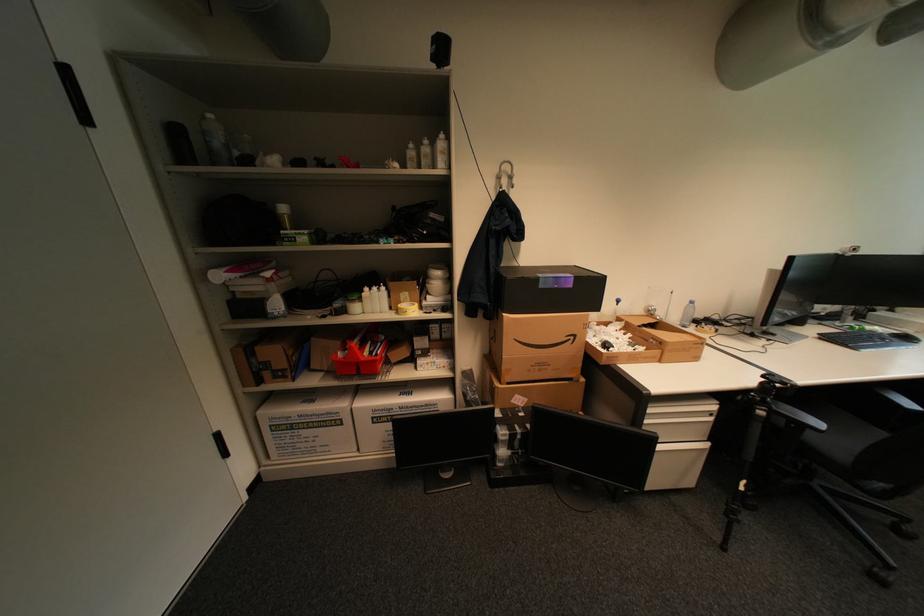
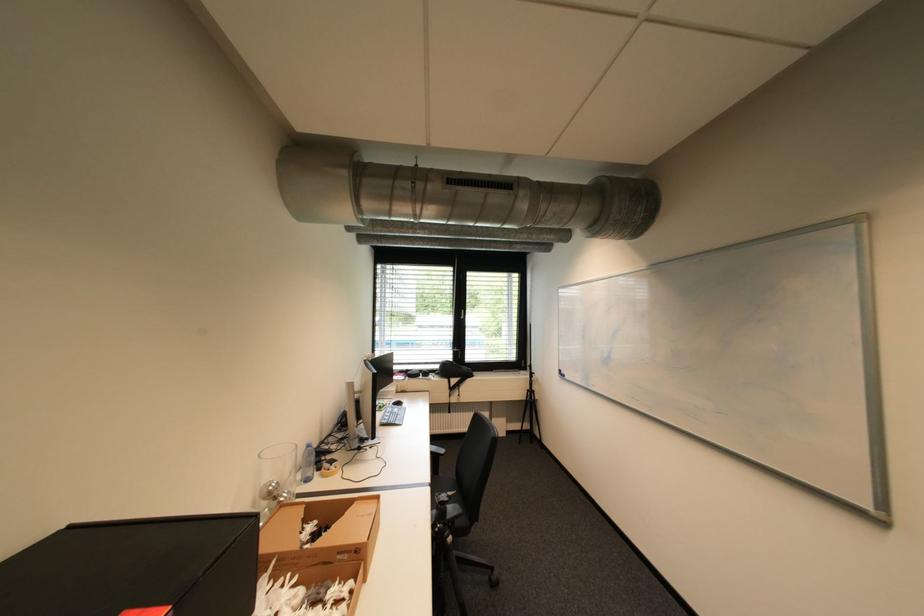
In the second image, find the point that corresponds to the point at 696,306 in the first image.

(313, 451)